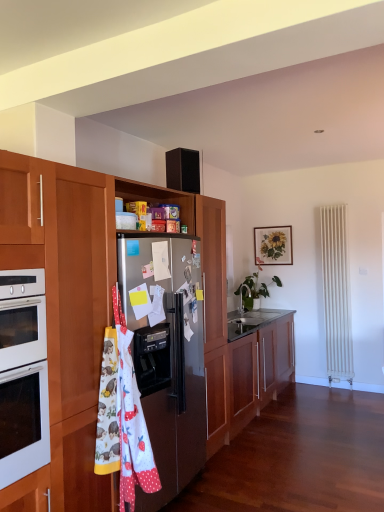
Question: Is green glossy plant at center in contact with wooden cabinet at center, marked as the 2th cabinetry in a bottom-to-top arrangement?

Choices:
 (A) yes
 (B) no

Answer: (B)

Question: Would you say green glossy plant at center contains wooden cabinet at center, marked as the 2th cabinetry in a bottom-to-top arrangement?

Choices:
 (A) no
 (B) yes

Answer: (A)

Question: Could you tell me if green glossy plant at center is turned towards wooden cabinet at center, the first cabinetry viewed from the top?

Choices:
 (A) no
 (B) yes

Answer: (B)

Question: From a real-world perspective, is green glossy plant at center under wooden cabinet at center, marked as the 2th cabinetry in a bottom-to-top arrangement?

Choices:
 (A) no
 (B) yes

Answer: (A)

Question: Is green glossy plant at center far from wooden cabinet at center, marked as the 2th cabinetry in a bottom-to-top arrangement?

Choices:
 (A) no
 (B) yes

Answer: (B)

Question: Looking at the image, does wooden cabinet at center, the first cabinetry viewed from the top, seem bigger or smaller compared to satin metallic refrigerator at center-left?

Choices:
 (A) big
 (B) small

Answer: (A)

Question: Visually, is wooden cabinet at center, marked as the 2th cabinetry in a bottom-to-top arrangement, positioned to the left or to the right of satin metallic refrigerator at center-left?

Choices:
 (A) left
 (B) right

Answer: (B)

Question: From a real-world perspective, relative to satin metallic refrigerator at center-left, is wooden cabinet at center, the first cabinetry viewed from the top, vertically above or below?

Choices:
 (A) above
 (B) below

Answer: (A)

Question: Relative to satin metallic refrigerator at center-left, is wooden cabinet at center, marked as the 2th cabinetry in a bottom-to-top arrangement, in front or behind?

Choices:
 (A) front
 (B) behind

Answer: (A)

Question: From a real-world perspective, relative to green glossy plant at center, is wooden picture frame at upper center vertically above or below?

Choices:
 (A) below
 (B) above

Answer: (B)

Question: Considering the positions of wooden picture frame at upper center and green glossy plant at center in the image, is wooden picture frame at upper center taller or shorter than green glossy plant at center?

Choices:
 (A) tall
 (B) short

Answer: (B)

Question: In the image, is wooden picture frame at upper center on the left side or the right side of green glossy plant at center?

Choices:
 (A) right
 (B) left

Answer: (A)

Question: Which is correct: wooden picture frame at upper center is inside green glossy plant at center, or outside of it?

Choices:
 (A) inside
 (B) outside

Answer: (B)

Question: Visually, is satin metallic refrigerator at center-left positioned to the left or to the right of wooden cabinet at center, marked as the 2th cabinetry in a bottom-to-top arrangement?

Choices:
 (A) right
 (B) left

Answer: (B)

Question: Is satin metallic refrigerator at center-left taller or shorter than wooden cabinet at center, the first cabinetry viewed from the top?

Choices:
 (A) short
 (B) tall

Answer: (A)